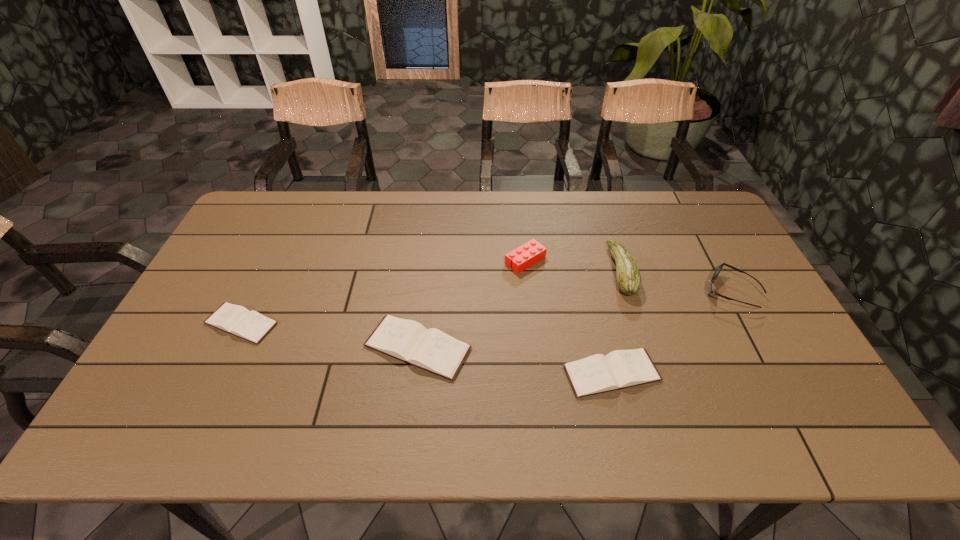
Considering the uniform spacing of diarys, where should an additional diary be positioned on the right? Please locate a free spot. Please provide its 2D coordinates. Your answer should be formatted as a tuple, i.e. [(x, y)], where the tuple contains the x and y coordinates of a point satisfying the conditions above.

[(826, 402)]